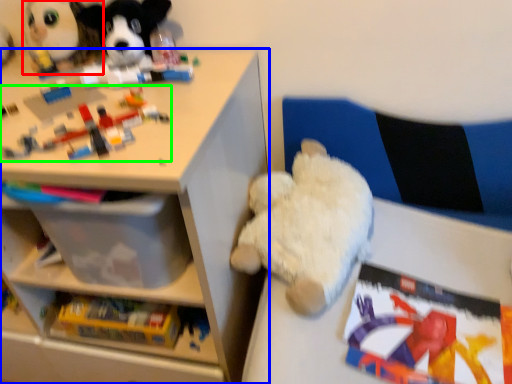
Question: Considering the real-world distances, which object is farthest from toy (highlighted by a red box)? shelf (highlighted by a blue box) or toy (highlighted by a green box)?

Choices:
 (A) shelf
 (B) toy

Answer: (A)